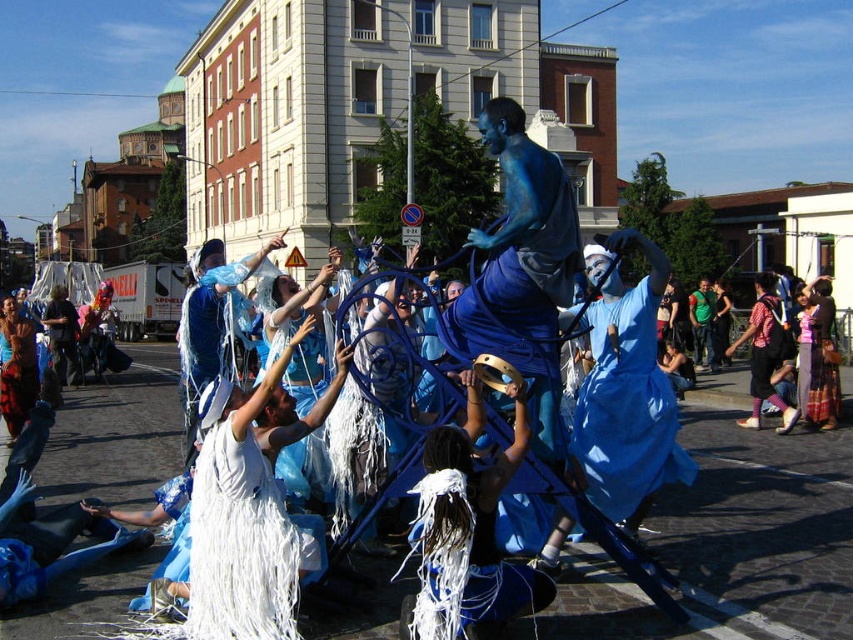
Does white fringed dress at center have a larger size compared to blue fabric dress at center?

Yes.

Is point (198, 596) closer to camera compared to point (654, 442)?

That is True.

Image resolution: width=853 pixels, height=640 pixels. Identify the location of white fringed dress at center. (239, 541).

Measure the distance from white fringed dress at center to white fringed fabric at lower center.

The distance of white fringed dress at center from white fringed fabric at lower center is 3.25 meters.

I want to click on white fringed dress at center, so click(239, 541).

Does white textured fabric dress at center appear under white feathered dress at center?

Incorrect, white textured fabric dress at center is not positioned below white feathered dress at center.

Which is behind, point (827, 348) or point (26, 387)?

Positioned behind is point (827, 348).

You are a GUI agent. You are given a task and a screenshot of the screen. Output one action in this format:
    pyautogui.click(x=<x>, y=<y>)
    Task: Click on the white textured fabric dress at center
    
    Given the screenshot: What is the action you would take?
    pyautogui.click(x=821, y=356)